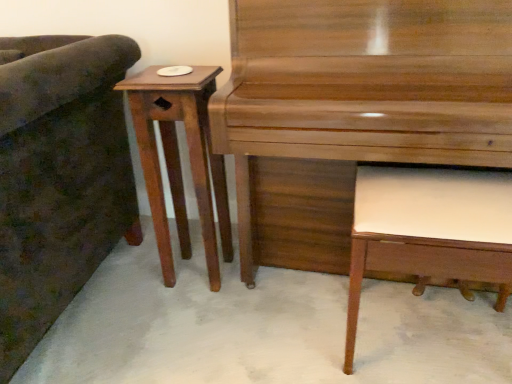
Where is `free space below mahogany wood side table at left (from a real-world perspective)`? free space below mahogany wood side table at left (from a real-world perspective) is located at coordinates (194, 273).